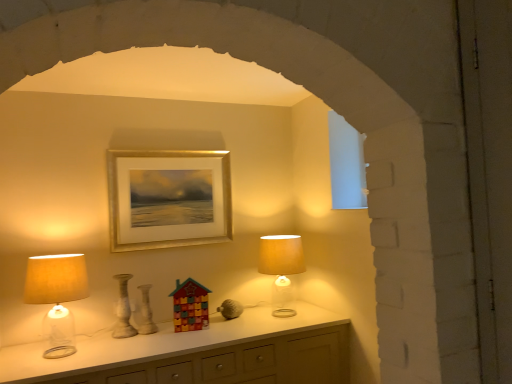
Question: Based on their positions, is matte beige lampshade at right, which is the second lamp from left to right, located to the left or right of white glossy vase at center, the second vase in the left-to-right sequence?

Choices:
 (A) right
 (B) left

Answer: (A)

Question: Choose the correct answer: Is matte beige lampshade at right, which is the second lamp from left to right, inside white glossy vase at center, the second vase in the left-to-right sequence, or outside it?

Choices:
 (A) inside
 (B) outside

Answer: (B)

Question: Considering the real-world distances, which object is farthest from the matte beige lampshade at left, which is the second lamp in right-to-left order?

Choices:
 (A) white glossy vase at center, the second vase in the left-to-right sequence
 (B) speckled ceramic vase at center, the second vase positioned from the right
 (C) gold metallic picture frame at upper center
 (D) matte beige lampshade at right, the first lamp viewed from the right

Answer: (D)

Question: Which object is the farthest from the speckled ceramic vase at center, the second vase positioned from the right?

Choices:
 (A) white glossy vase at center, the second vase in the left-to-right sequence
 (B) matte beige lampshade at right, which is the second lamp from left to right
 (C) gold metallic picture frame at upper center
 (D) matte beige lampshade at left, the first lamp in the left-to-right sequence

Answer: (B)